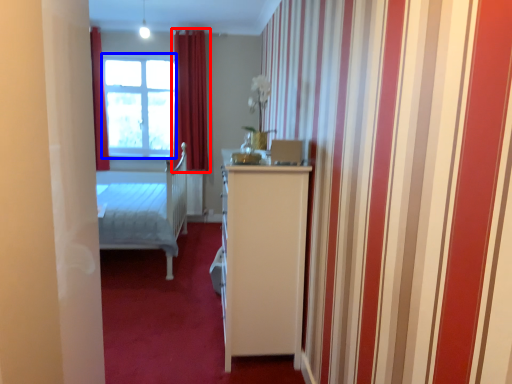
Question: Which point is closer to the camera, curtain (highlighted by a red box) or window (highlighted by a blue box)?

Choices:
 (A) curtain
 (B) window

Answer: (A)